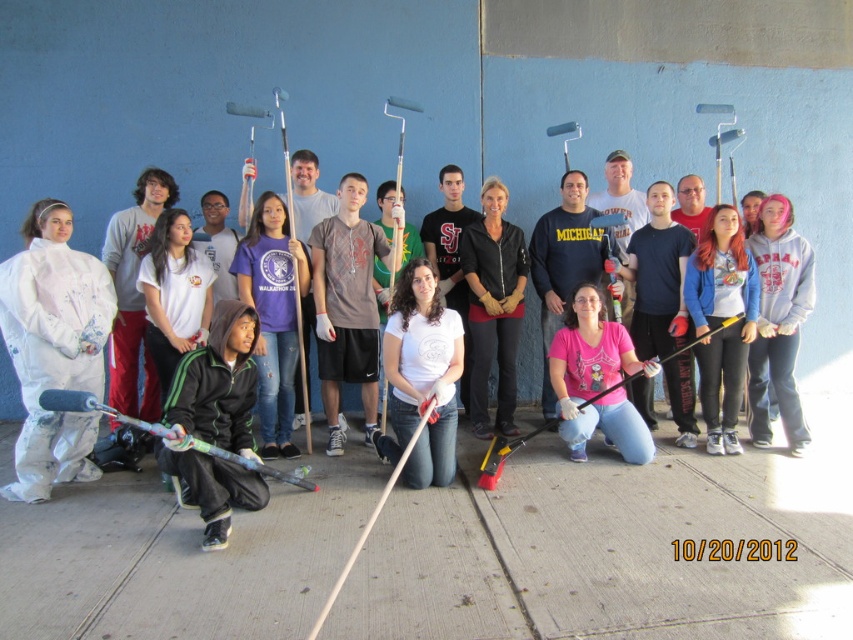
You are a photographer standing at the center of the scene. You want to take a photo of the white matte coveralls at left. Which direction should you move to get it in frame?

The white matte coveralls at left is located at point 0.544 on the x axis and 0.063 on the y axis. Since you are at the center, you should move to the left and slightly downward to align with its position.

You are a photographer trying to capture a photo of the community service event. You want to ensure both the white matte coveralls at left and the green hoodie at center are in the frame. Based on their positions, which object should you focus on first to include both in the shot?

The white matte coveralls at left is to the left of green hoodie at center, so you should focus on the white matte coveralls at left first to ensure both are included in the shot.